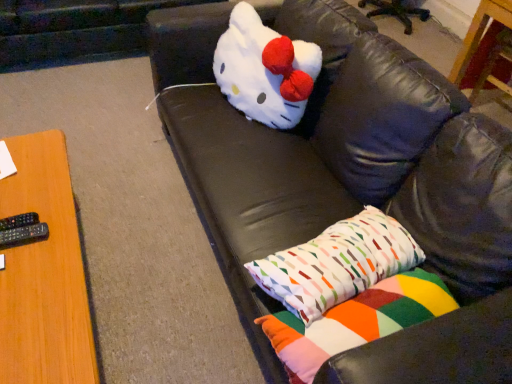
This screenshot has width=512, height=384. I want to click on free space above wooden table at left, marked as the 2th table in a back-to-front arrangement (from a real-world perspective), so click(29, 237).